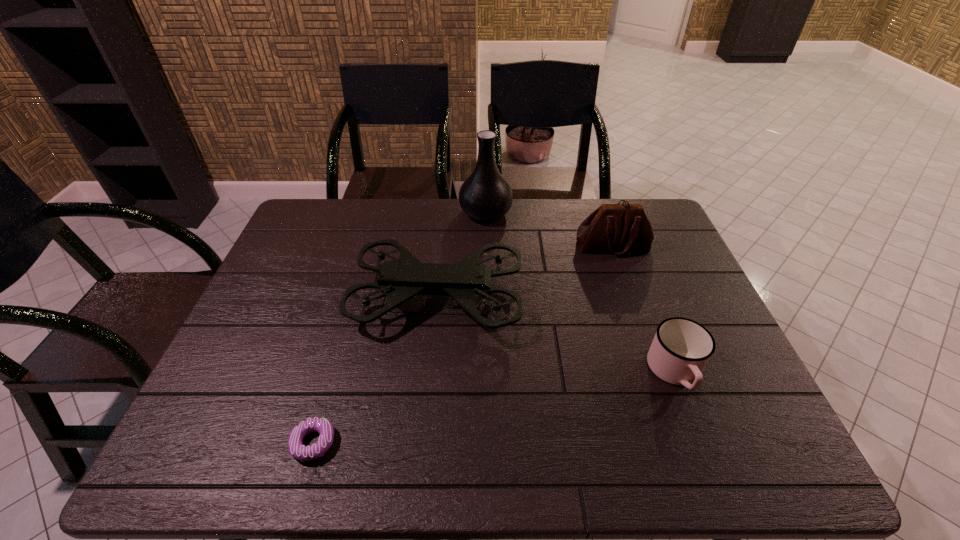
What are the coordinates of `vacant area situated on the back of the second farthest object` in the screenshot? It's located at click(602, 217).

Identify the location of vacant space located 0.130m on the side of the mug with the handle. (709, 460).

At what (x,y) coordinates should I click in order to perform the action: click on free region located on the right of the nearest object. Please return your answer as a coordinate pair (x, y). Looking at the image, I should click on (468, 443).

In order to click on vase that is positioned at the far edge in this screenshot , I will do `click(485, 195)`.

You are a GUI agent. You are given a task and a screenshot of the screen. Output one action in this format:
    pyautogui.click(x=<x>, y=<y>)
    Task: Click on the shoulder bag located in the far edge section of the desktop
    The width and height of the screenshot is (960, 540).
    Given the screenshot: What is the action you would take?
    pyautogui.click(x=618, y=228)

Find the location of a particular element. object situated at the near edge is located at coordinates (303, 453).

I want to click on shoulder bag that is at the right edge, so click(x=618, y=228).

What are the coordinates of `mug at the right edge` in the screenshot? It's located at (681, 348).

This screenshot has width=960, height=540. Find the location of `object that is positioned at the far right corner`. object that is positioned at the far right corner is located at coordinates (618, 228).

Locate an element on the screen. The width and height of the screenshot is (960, 540). vacant space at the far edge of the desktop is located at coordinates (449, 221).